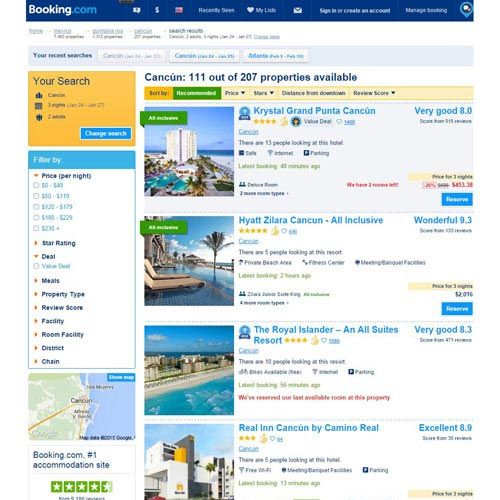
At what (x,y) coordinates should I click in order to perform the action: click on yellow column. Please return your answer as a coordinate pair (x, y). The height and width of the screenshot is (500, 500). Looking at the image, I should click on (181, 452).